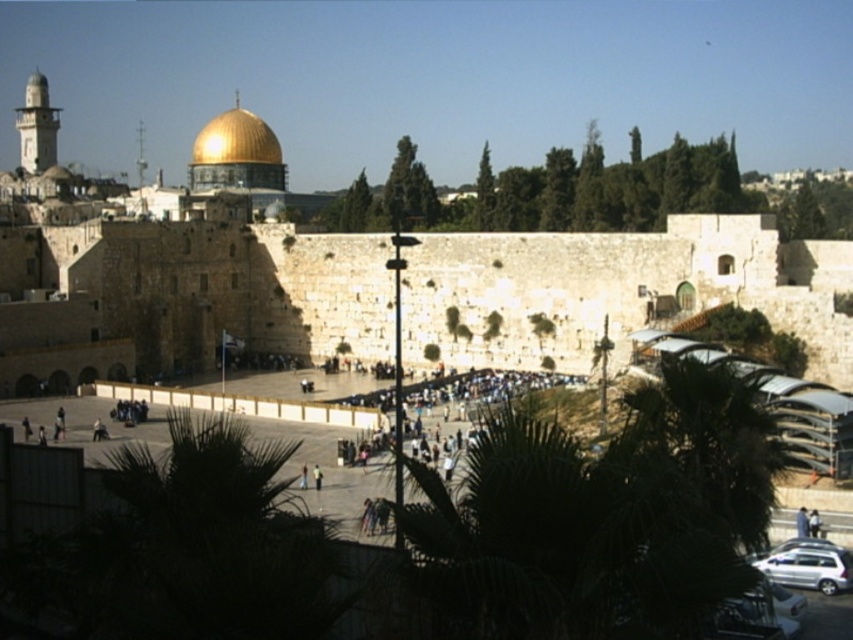
Between point (144, 541) and point (221, 141), which one is positioned in front?

Point (144, 541) is in front.

Which is more to the right, green leafy palm tree at lower left or gold shiny dome at upper center?

Positioned to the right is green leafy palm tree at lower left.

Is point (303, 525) closer to camera compared to point (212, 145)?

Yes, point (303, 525) is closer to viewer.

Find the location of a particular element. This screenshot has height=640, width=853. green leafy palm tree at lower left is located at coordinates (209, 541).